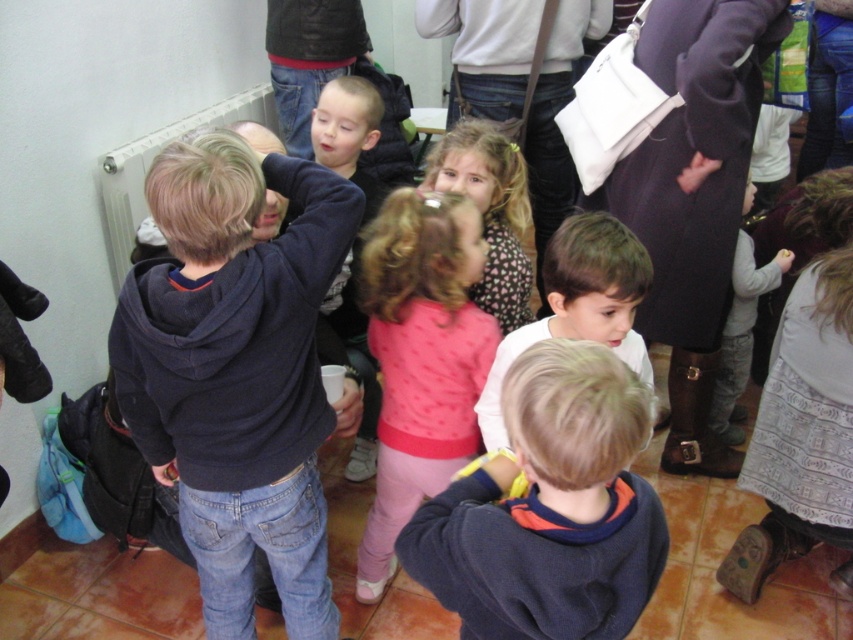
Question: Based on their relative distances, which object is farther from the dark blue hoodie at center?

Choices:
 (A) dark blue sweatshirt at center
 (B) pink fabric dress at center

Answer: (A)

Question: Is dark blue hoodie at center below pink fabric dress at center?

Choices:
 (A) yes
 (B) no

Answer: (A)

Question: Is dark blue hoodie at center below pink fabric dress at center?

Choices:
 (A) no
 (B) yes

Answer: (B)

Question: In this image, where is dark blue sweatshirt at center located relative to pink fabric dress at center?

Choices:
 (A) left
 (B) right

Answer: (B)

Question: Which of the following is the farthest from the observer?

Choices:
 (A) dark blue sweatshirt at center
 (B) dark blue hoodie at center

Answer: (B)

Question: Among these points, which one is nearest to the camera?

Choices:
 (A) coord(456,611)
 (B) coord(401,320)
 (C) coord(294,337)

Answer: (A)